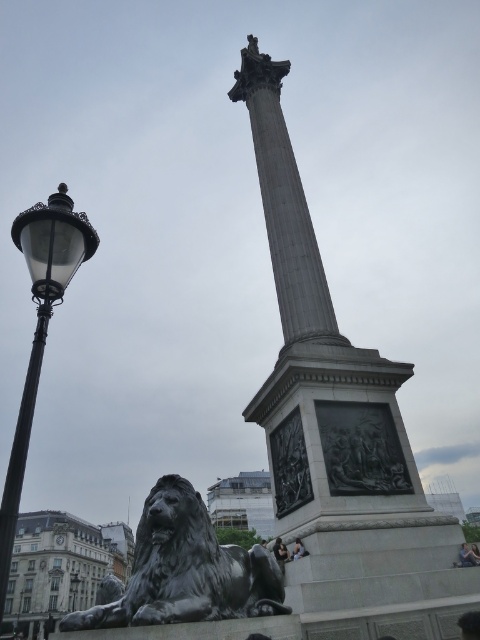
Who is shorter, gray stone column at center or black metal/texture lamp post at left?

black metal/texture lamp post at left

Who is more forward, (x=376, y=556) or (x=21, y=212)?

Point (x=21, y=212) is more forward.

Where is `gray stone column at center`? gray stone column at center is located at coordinates (335, 413).

Is light brown leather jacket at lower right positioned in front of dark hair at lower center?

No, light brown leather jacket at lower right is behind dark hair at lower center.

Where is `light brown leather jacket at lower right`? The image size is (480, 640). light brown leather jacket at lower right is located at coordinates (468, 556).

Find the location of a particular element. The width and height of the screenshot is (480, 640). light brown leather jacket at lower right is located at coordinates (468, 556).

Between point (265, 579) and point (296, 552), which one is positioned behind?

Positioned behind is point (296, 552).

Based on the photo, is polished bronze lion at lower left below dark hair at lower center?

Yes, polished bronze lion at lower left is below dark hair at lower center.

Where is `polished bronze lion at lower left`? This screenshot has height=640, width=480. polished bronze lion at lower left is located at coordinates (186, 570).

Where is `polished bronze lion at lower left`? polished bronze lion at lower left is located at coordinates (186, 570).